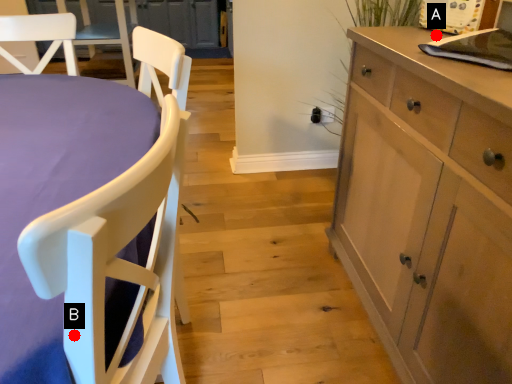
Question: Two points are circled on the image, labeled by A and B beside each circle. Which point is closer to the camera?

Choices:
 (A) A is closer
 (B) B is closer

Answer: (B)